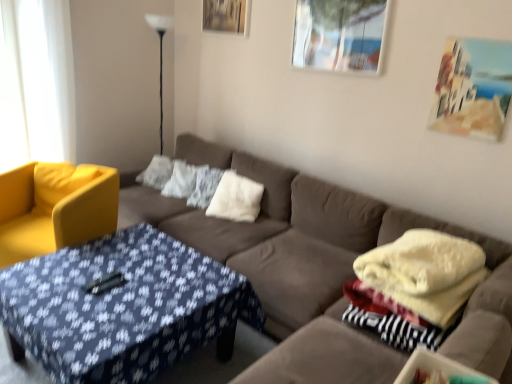
Question: Looking at the image, does black glass floor lamp at upper left seem bigger or smaller compared to wooden picture frame at upper center, positioned as the third picture frame in bottom-to-top order?

Choices:
 (A) small
 (B) big

Answer: (B)

Question: From a real-world perspective, is black glass floor lamp at upper left above or below wooden picture frame at upper center, positioned as the first picture frame in top-to-bottom order?

Choices:
 (A) above
 (B) below

Answer: (B)

Question: Which object is positioned farthest from the matte yellow armchair at left?

Choices:
 (A) matte brown couch at center
 (B) black glass floor lamp at upper left
 (C) white fluffy pillow at center, which is the 3th pillow in right-to-left order
 (D) blue fabric-covered coffee table at center
 (E) painted canvas at upper right, which is the first picture frame from bottom to top

Answer: (E)

Question: Which is nearer to the white fluffy pillow at center, which is the 3th pillow in right-to-left order?

Choices:
 (A) black glass floor lamp at upper left
 (B) matte yellow armchair at left
 (C) white fluffy pillow at center, which is the second pillow from right to left
 (D) white fluffy pillow at center, the third pillow in the left-to-right sequence
 (E) metallic glass picture frame at upper right, positioned as the second picture frame in bottom-to-top order

Answer: (C)